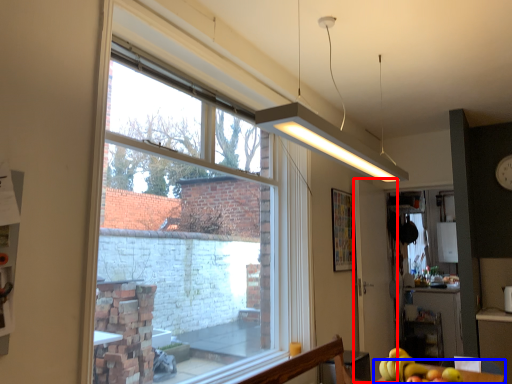
Question: Which object is closer to the camera taking this photo, screen door (highlighted by a red box) or table (highlighted by a blue box)?

Choices:
 (A) screen door
 (B) table

Answer: (B)